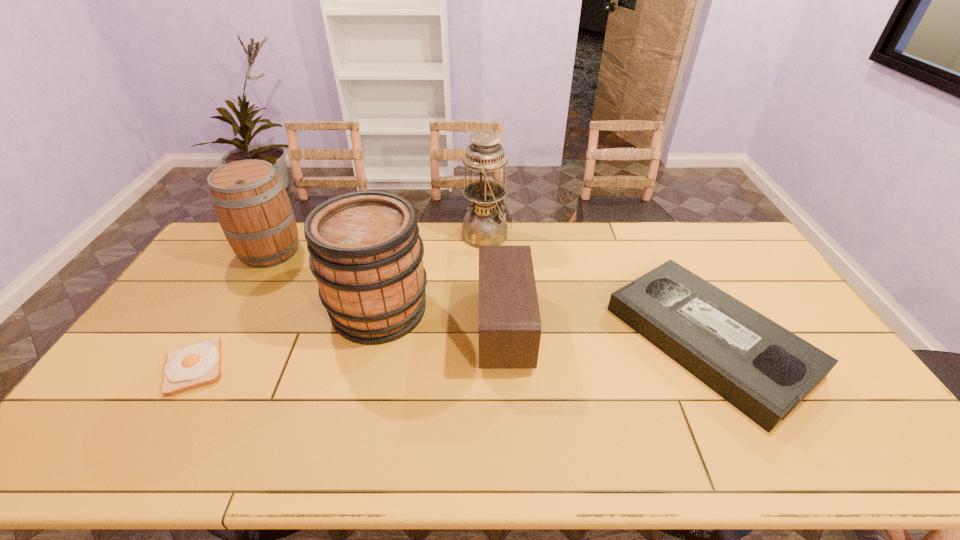
In order to click on free spot between the radio receiver and the right cider in this screenshot , I will do `click(442, 319)`.

Where is `object that can be found as the second closest to the radio receiver`? object that can be found as the second closest to the radio receiver is located at coordinates pos(485,224).

Locate which object is the closest to the farther cider. Please provide its 2D coordinates. Your answer should be formatted as a tuple, i.e. [(x, y)], where the tuple contains the x and y coordinates of a point satisfying the conditions above.

[(366, 254)]

At what (x,y) coordinates should I click in order to perform the action: click on vacant region that satisfies the following two spatial constraints: 1. on the back side of the toast; 2. on the left side of the second shortest object. Please return your answer as a coordinate pair (x, y). Looking at the image, I should click on (210, 341).

The height and width of the screenshot is (540, 960). What are the coordinates of `free region that satisfies the following two spatial constraints: 1. on the front-facing side of the radio receiver; 2. on the left side of the videotape` in the screenshot? It's located at (505, 341).

Where is `vacant space that satisfies the following two spatial constraints: 1. on the back side of the farther cider; 2. on the left side of the toast`? This screenshot has width=960, height=540. vacant space that satisfies the following two spatial constraints: 1. on the back side of the farther cider; 2. on the left side of the toast is located at coordinates (264, 251).

This screenshot has width=960, height=540. What are the coordinates of `vacant area in the image that satisfies the following two spatial constraints: 1. on the front-facing side of the rightmost object; 2. on the right side of the third shortest object` in the screenshot? It's located at (505, 341).